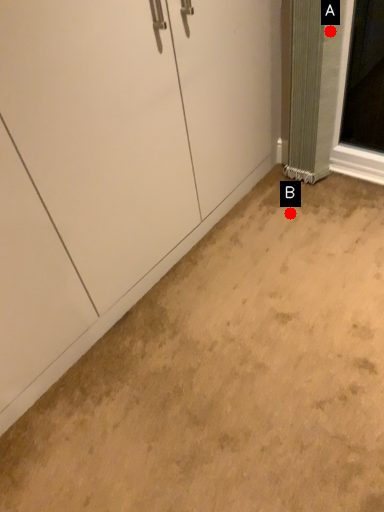
Question: Two points are circled on the image, labeled by A and B beside each circle. Which of the following is the farthest from the observer?

Choices:
 (A) A is further
 (B) B is further

Answer: (B)